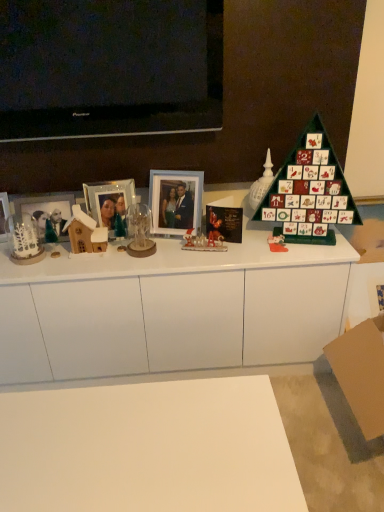
The width and height of the screenshot is (384, 512). What are the coordinates of `unoccupied area in front of white frosted glass jar at left, which is counted as the first toy, starting from the left` in the screenshot? It's located at (24, 269).